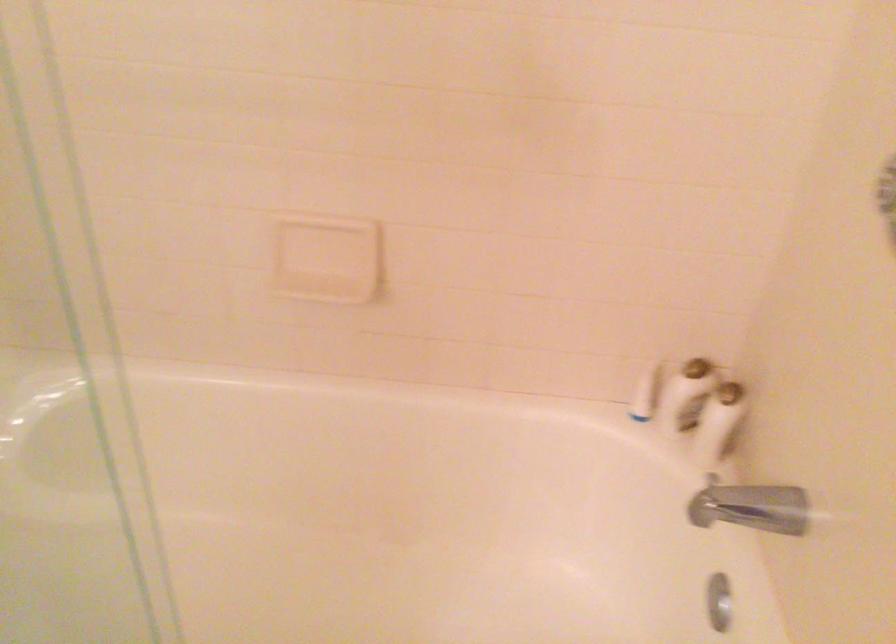
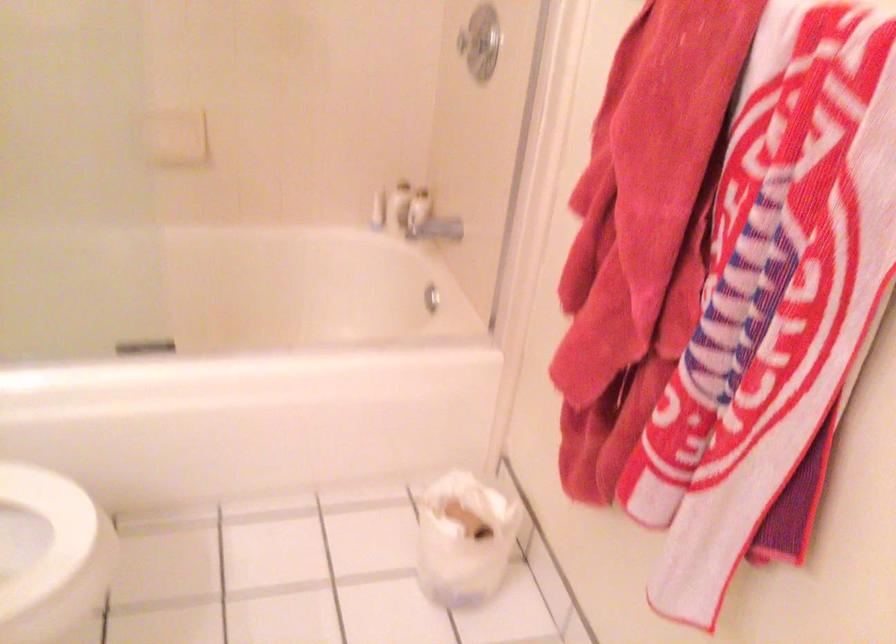
Where in the second image is the point corresponding to pixel 730 436 from the first image?

(429, 221)